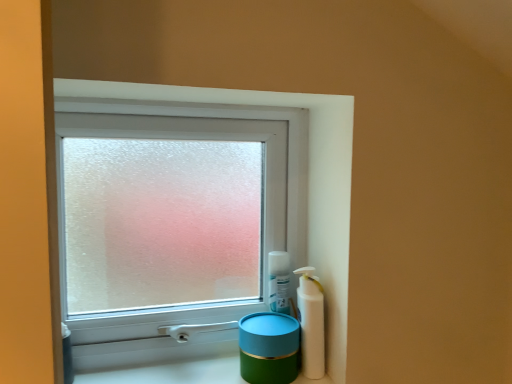
What is the approximate height of teal glossy jar at lower right?

The height of teal glossy jar at lower right is 10.94 centimeters.

The height and width of the screenshot is (384, 512). What do you see at coordinates (311, 323) in the screenshot? I see `white plastic bottle at right` at bounding box center [311, 323].

This screenshot has height=384, width=512. What do you see at coordinates (175, 217) in the screenshot?
I see `frosted glass window at center` at bounding box center [175, 217].

What is the approximate width of frosted glass window at center?

6.87 centimeters.

Identify the location of teal glossy jar at lower right. (269, 348).

Considering the relative sizes of teal glossy jar at lower right and green matte container at lower center in the image provided, is teal glossy jar at lower right shorter than green matte container at lower center?

In fact, teal glossy jar at lower right may be taller than green matte container at lower center.

What's the angular difference between teal glossy jar at lower right and green matte container at lower center's facing directions?

0.87 degrees.

Which is closer to the camera, (x=262, y=373) or (x=103, y=382)?

The point (x=262, y=373) is closer to the camera.

Can you confirm if teal glossy jar at lower right is bigger than green matte container at lower center?

Incorrect, teal glossy jar at lower right is not larger than green matte container at lower center.

Would you say frosted glass window at center is to the left or to the right of white plastic bottle at right in the picture?

frosted glass window at center is to the left of white plastic bottle at right.

Is the position of frosted glass window at center more distant than that of white plastic bottle at right?

That is True.

From the picture: Measure the distance from frosted glass window at center to white plastic bottle at right.

frosted glass window at center is 12.00 inches away from white plastic bottle at right.

Locate an element on the screen. This screenshot has height=384, width=512. window located above the white plastic bottle at right (from the image's perspective) is located at coordinates (175, 217).

Is white plastic bottle at right positioned with its back to teal glossy jar at lower right?

No, white plastic bottle at right is not facing away from teal glossy jar at lower right.

Looking at this image, who is bigger, white plastic bottle at right or teal glossy jar at lower right?

With larger size is teal glossy jar at lower right.

Considering the sizes of objects white plastic bottle at right and teal glossy jar at lower right in the image provided, who is wider, white plastic bottle at right or teal glossy jar at lower right?

teal glossy jar at lower right.

Who is more distant, white plastic bottle at right or teal glossy jar at lower right?

white plastic bottle at right is further away from the camera.

Is teal glossy jar at lower right directly adjacent to frosted glass window at center?

No, teal glossy jar at lower right is not in contact with frosted glass window at center.

Between teal glossy jar at lower right and frosted glass window at center, which one has larger width?

teal glossy jar at lower right.

From the picture: Which object is further away from the camera taking this photo, teal glossy jar at lower right or frosted glass window at center?

frosted glass window at center is further away from the camera.

The image size is (512, 384). There is a teal glossy jar at lower right. In order to click on window above it (from a real-world perspective) in this screenshot , I will do `click(175, 217)`.

In the image, is green matte container at lower center on the left side or the right side of white plastic bottle at right?

From the image, it's evident that green matte container at lower center is to the left of white plastic bottle at right.

Which is behind, point (221, 381) or point (316, 318)?

The point (221, 381) is farther from the camera.

How many degrees apart are the facing directions of green matte container at lower center and white plastic bottle at right?

There is a 0.87-degree angle between the facing directions of green matte container at lower center and white plastic bottle at right.

Would you consider green matte container at lower center to be distant from white plastic bottle at right?

green matte container at lower center is near white plastic bottle at right, not far away.

Who is more distant, teal glossy jar at lower right or white plastic bottle at right?

white plastic bottle at right is behind.

Is teal glossy jar at lower right facing away from white plastic bottle at right?

No, white plastic bottle at right is not at the back of teal glossy jar at lower right.

What's the angular difference between teal glossy jar at lower right and white plastic bottle at right's facing directions?

The facing directions of teal glossy jar at lower right and white plastic bottle at right are 0.000985 degrees apart.

Considering the sizes of objects teal glossy jar at lower right and white plastic bottle at right in the image provided, who is shorter, teal glossy jar at lower right or white plastic bottle at right?

teal glossy jar at lower right is shorter.

Find the location of a particular element. The image size is (512, 384). mouthwash that appears on the right of frosted glass window at center is located at coordinates (311, 323).

Is white plastic bottle at right turned away from frosted glass window at center?

Yes.

Which is nearer, [310,267] or [283,136]?

The point [310,267] is closer.

From the image's perspective, between white plastic bottle at right and frosted glass window at center, who is located below?

white plastic bottle at right is shown below in the image.

This screenshot has height=384, width=512. Identify the location of counter top below the teal glossy jar at lower right (from the image's perspective). (172, 372).

Where is `window above the white plastic bottle at right (from a real-world perspective)`? Image resolution: width=512 pixels, height=384 pixels. window above the white plastic bottle at right (from a real-world perspective) is located at coordinates (175, 217).

Considering their positions, is green matte container at lower center positioned further to teal glossy jar at lower right than frosted glass window at center?

The object further to teal glossy jar at lower right is frosted glass window at center.

Looking at the image, which one is located closer to green matte container at lower center, frosted glass window at center or white plastic bottle at right?

white plastic bottle at right is positioned closer to the anchor green matte container at lower center.

Which object lies further to the anchor point white plastic bottle at right, frosted glass window at center or teal glossy jar at lower right?

frosted glass window at center lies further to white plastic bottle at right than the other object.

Based on their spatial positions, is white plastic bottle at right or green matte container at lower center further from teal glossy jar at lower right?

Based on the image, green matte container at lower center appears to be further to teal glossy jar at lower right.

From the image, which object appears to be nearer to frosted glass window at center, green matte container at lower center or white plastic bottle at right?

green matte container at lower center.

Estimate the real-world distances between objects in this image. Which object is closer to green matte container at lower center, white plastic bottle at right or teal glossy jar at lower right?

The object closer to green matte container at lower center is teal glossy jar at lower right.

Looking at the image, which one is located further to frosted glass window at center, white plastic bottle at right or teal glossy jar at lower right?

white plastic bottle at right lies further to frosted glass window at center than the other object.

Looking at the image, which one is located closer to white plastic bottle at right, green matte container at lower center or teal glossy jar at lower right?

The object closer to white plastic bottle at right is teal glossy jar at lower right.

Locate an element on the screen. This screenshot has width=512, height=384. teal that lies between frosted glass window at center and green matte container at lower center from top to bottom is located at coordinates (269, 348).

Find the location of a particular element. The height and width of the screenshot is (384, 512). mouthwash between frosted glass window at center and green matte container at lower center in the vertical direction is located at coordinates (311, 323).

The height and width of the screenshot is (384, 512). Identify the location of mouthwash between frosted glass window at center and teal glossy jar at lower right in the up-down direction. (311, 323).

At what (x,y) coordinates should I click in order to perform the action: click on teal situated between green matte container at lower center and white plastic bottle at right from left to right. Please return your answer as a coordinate pair (x, y). Looking at the image, I should click on (269, 348).